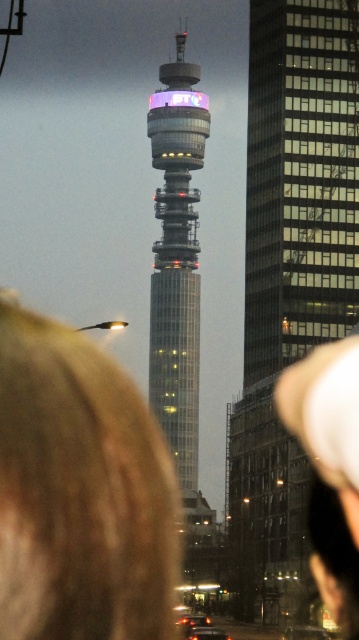
Can you confirm if blonde hair at lower left is positioned above glassy metallic tower at center?

No, blonde hair at lower left is not above glassy metallic tower at center.

Is blonde hair at lower left to the left of glassy metallic tower at center from the viewer's perspective?

In fact, blonde hair at lower left is to the right of glassy metallic tower at center.

What do you see at coordinates (78, 492) in the screenshot? This screenshot has width=359, height=640. I see `blonde hair at lower left` at bounding box center [78, 492].

Identify the location of blonde hair at lower left. (78, 492).

Does point (14, 630) come in front of point (292, 371)?

Yes, it is.

Who is more forward, (38,484) or (330,445)?

Positioned in front is point (38,484).

The width and height of the screenshot is (359, 640). Identify the location of blonde hair at lower left. (78, 492).

Between glassy metallic tower at center and white fabric cap at upper right, which one has less height?

white fabric cap at upper right is shorter.

Who is more forward, (x=185, y=68) or (x=316, y=577)?

Point (x=316, y=577) is more forward.

In order to click on glassy metallic tower at center in this screenshot , I will do `click(176, 259)`.